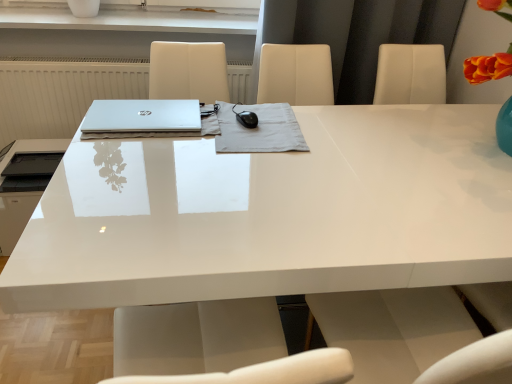
Question: Is the depth of matte black printer at left less than that of sleek silver laptop at center?

Choices:
 (A) yes
 (B) no

Answer: (B)

Question: Can you confirm if matte black printer at left is smaller than sleek silver laptop at center?

Choices:
 (A) no
 (B) yes

Answer: (A)

Question: Could sleek silver laptop at center be considered to be inside matte black printer at left?

Choices:
 (A) no
 (B) yes

Answer: (A)

Question: Is matte black printer at left aimed at sleek silver laptop at center?

Choices:
 (A) no
 (B) yes

Answer: (A)

Question: Can you confirm if matte black printer at left is positioned to the left of sleek silver laptop at center?

Choices:
 (A) yes
 (B) no

Answer: (A)

Question: Is matte black printer at left wider than sleek silver laptop at center?

Choices:
 (A) yes
 (B) no

Answer: (A)

Question: Are satin black mouse at center and white glossy desk at center making contact?

Choices:
 (A) yes
 (B) no

Answer: (B)

Question: Is satin black mouse at center behind white glossy desk at center?

Choices:
 (A) no
 (B) yes

Answer: (B)

Question: Considering the relative sizes of satin black mouse at center and white glossy desk at center in the image provided, is satin black mouse at center wider than white glossy desk at center?

Choices:
 (A) no
 (B) yes

Answer: (A)

Question: From the image's perspective, is satin black mouse at center located above white glossy desk at center?

Choices:
 (A) yes
 (B) no

Answer: (A)

Question: From a real-world perspective, is satin black mouse at center located higher than white glossy desk at center?

Choices:
 (A) no
 (B) yes

Answer: (B)

Question: Considering the relative positions of satin black mouse at center and white glossy desk at center in the image provided, is satin black mouse at center to the right of white glossy desk at center from the viewer's perspective?

Choices:
 (A) no
 (B) yes

Answer: (A)

Question: From the image's perspective, is satin black mouse at center over matte black printer at left?

Choices:
 (A) yes
 (B) no

Answer: (A)